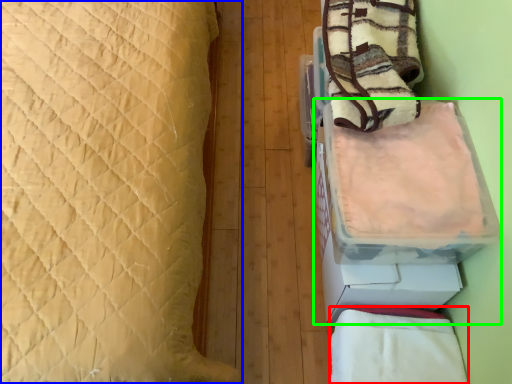
Question: Which is farther away from blanket (highlighted by a red box)? bed (highlighted by a blue box) or cardboard box (highlighted by a green box)?

Choices:
 (A) bed
 (B) cardboard box

Answer: (A)